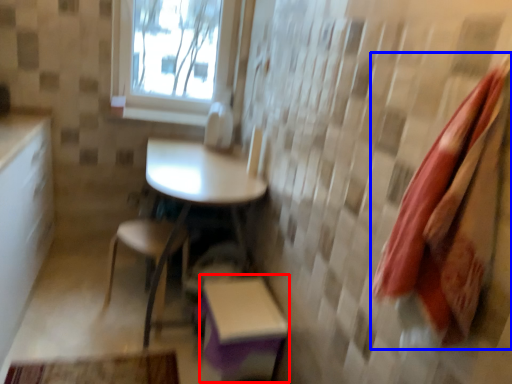
Question: Which point is further to the camera, step stool (highlighted by a red box) or beach towel (highlighted by a blue box)?

Choices:
 (A) step stool
 (B) beach towel

Answer: (A)